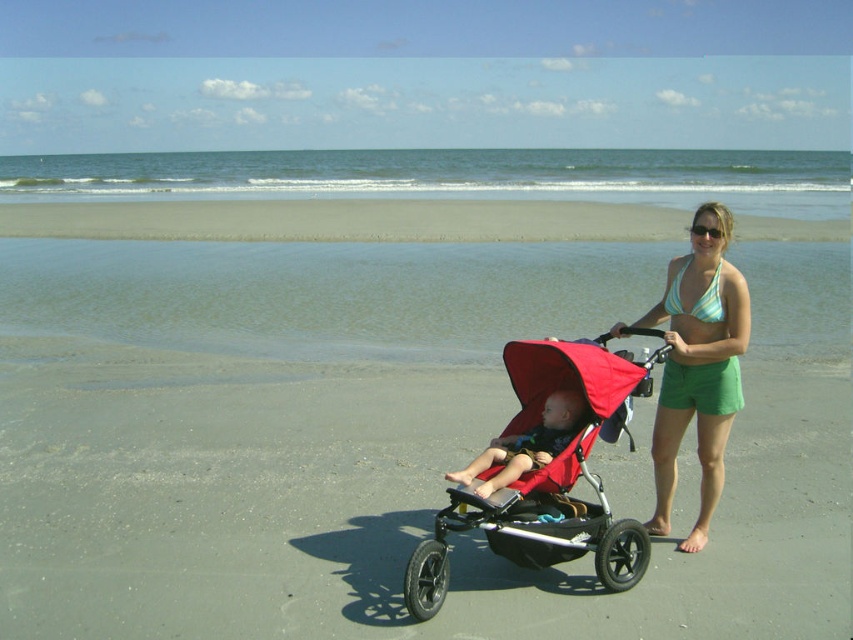
You are a photographer trying to capture a photo of the beach scene. You want to ensure that both the green cotton shorts at center and the matte red stroller at center are clearly visible in the frame. Based on their heights, which object will appear taller in the photo?

The green cotton shorts at center will appear taller in the photo since it has a greater height compared to the matte red stroller at center according to the description.

You are a photographer standing at the beach and want to focus on the red matte stroller at center and the green cotton shorts at center in your shot. Which object should you adjust your camera to focus on first if you want to capture both clearly?

The red matte stroller at center is closer to the viewer than the green cotton shorts at center, so you should focus on the red matte stroller at center first to ensure both are in focus.